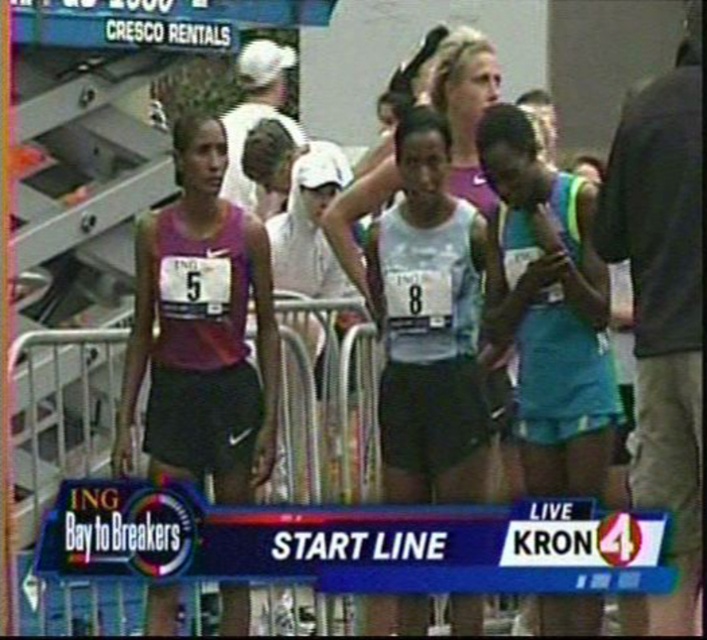
Is teal fabric tank top at center taller than white matte tank top at center?

In fact, teal fabric tank top at center may be shorter than white matte tank top at center.

Who is more forward, (583, 468) or (346, 257)?

Point (583, 468)

This screenshot has width=707, height=640. Identify the location of teal fabric tank top at center. (547, 308).

Between matte purple tank top at left and teal fabric tank top at center, which one has more height?

With more height is teal fabric tank top at center.

Consider the image. Which is more to the right, matte purple tank top at left or teal fabric tank top at center?

From the viewer's perspective, teal fabric tank top at center appears more on the right side.

Which is in front, point (239, 266) or point (527, 385)?

Point (527, 385)

Image resolution: width=707 pixels, height=640 pixels. What are the coordinates of `matte purple tank top at left` in the screenshot? It's located at (201, 330).

Is matte purple tank top at left positioned at the back of white matte tank top at center?

That is False.

Who is taller, matte purple tank top at left or white matte tank top at center?

Standing taller between the two is white matte tank top at center.

Which is in front, point (180, 180) or point (338, 220)?

Point (180, 180) is in front.

Locate an element on the screen. The width and height of the screenshot is (707, 640). matte purple tank top at left is located at coordinates (201, 330).